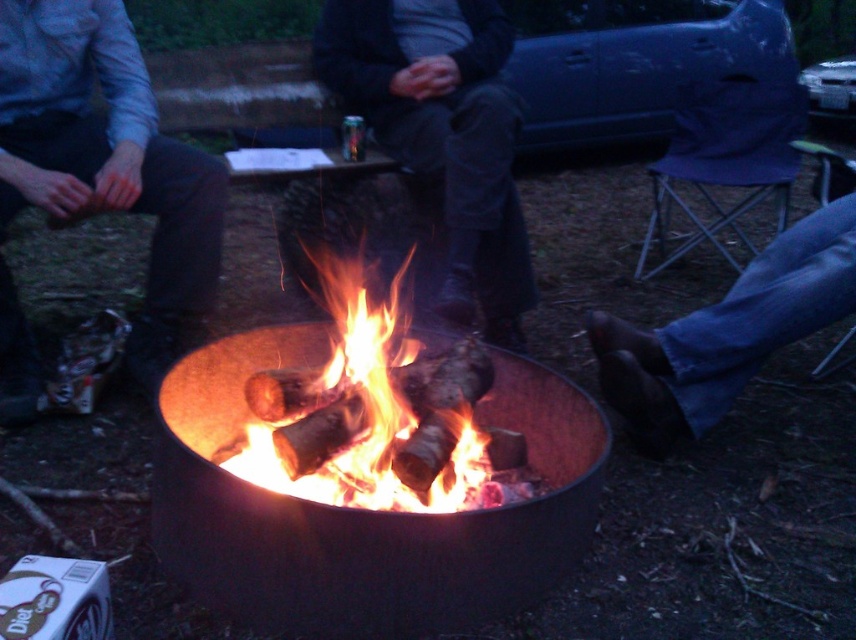
Question: Does brushed metal can at lower left have a lesser width compared to dark gray sweater at center?

Choices:
 (A) yes
 (B) no

Answer: (A)

Question: Among these points, which one is farthest from the camera?

Choices:
 (A) (660, 413)
 (B) (331, 627)

Answer: (A)

Question: In this image, where is brushed metal can at lower left located relative to bright orange flames at center?

Choices:
 (A) left
 (B) right

Answer: (A)

Question: Which point appears farthest from the camera in this image?

Choices:
 (A) (100, 68)
 (B) (733, 378)

Answer: (A)

Question: Which point appears closest to the camera in this image?

Choices:
 (A) (204, 305)
 (B) (474, 56)

Answer: (A)

Question: Can you confirm if black metal fire pit at center is positioned to the left of bright orange flames at center?

Choices:
 (A) no
 (B) yes

Answer: (A)